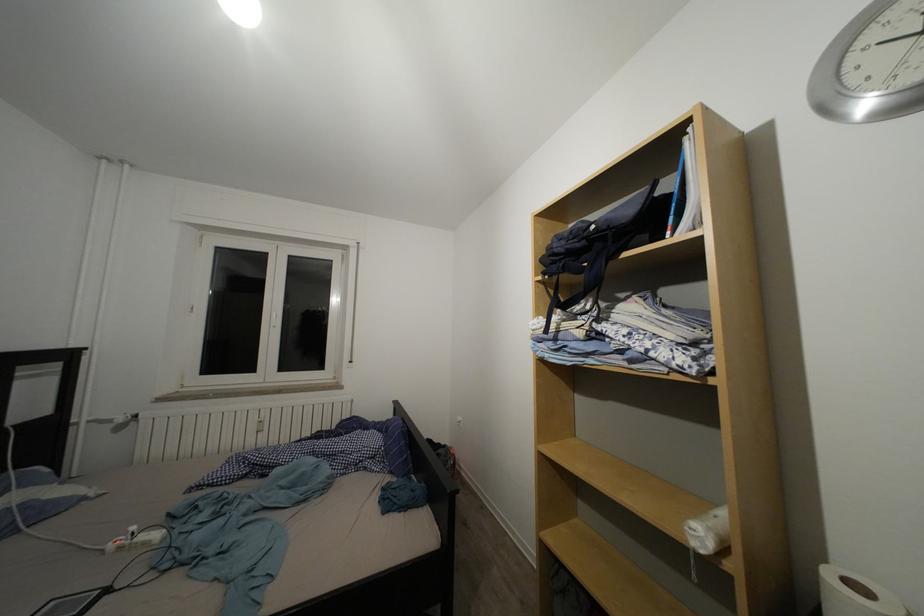
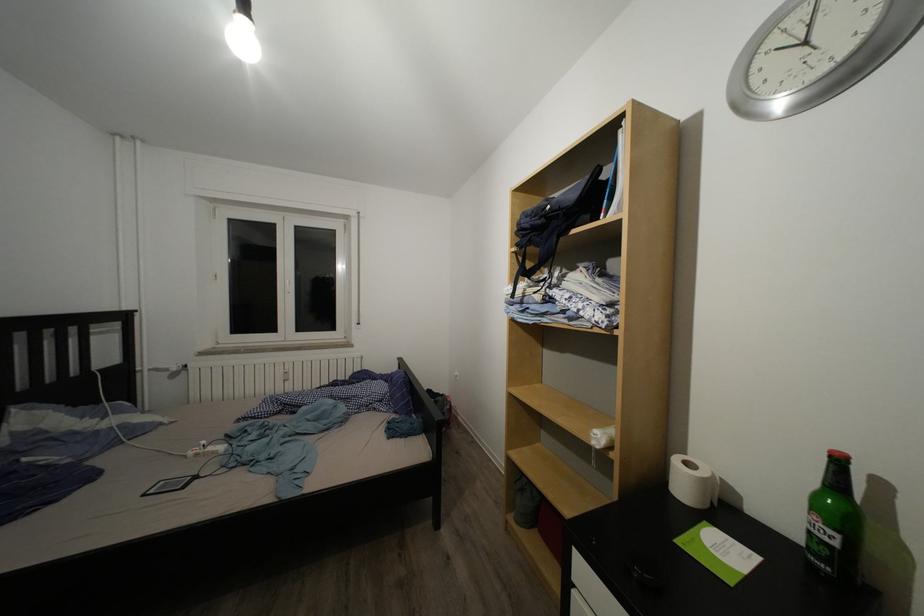
Which direction would the cameraman need to move to produce the second image?

The cameraman moved toward right, backward.